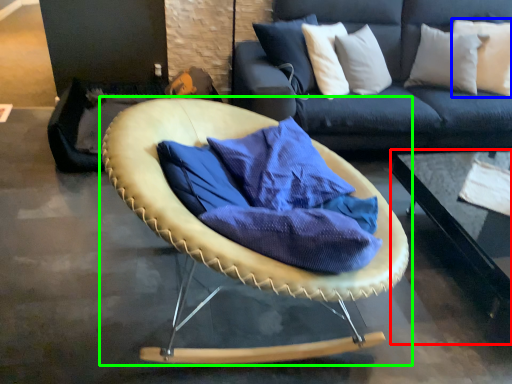
Question: Considering the real-world distances, which object is closest to table (highlighted by a red box)? pillow (highlighted by a blue box) or chair (highlighted by a green box).

Choices:
 (A) pillow
 (B) chair

Answer: (A)